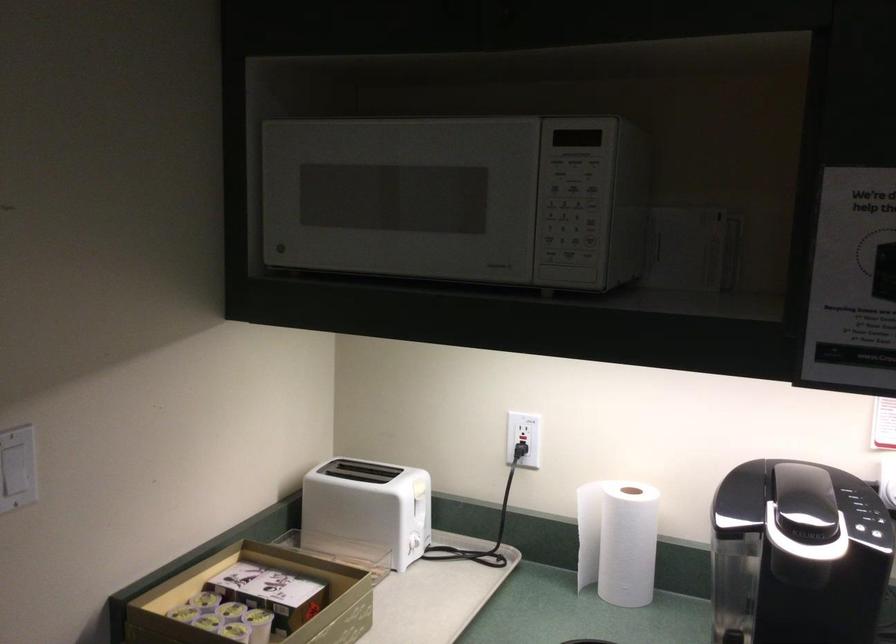
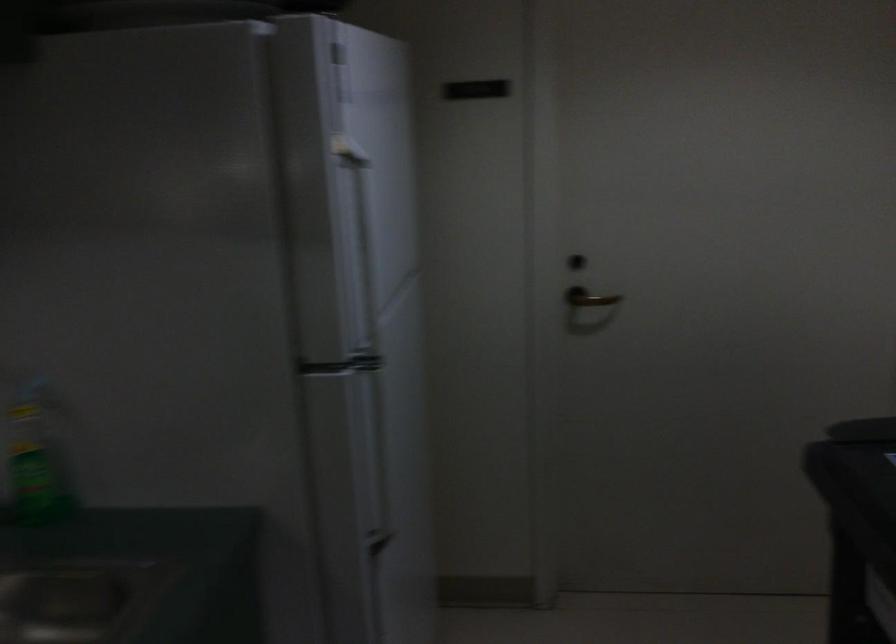
The first image is from the beginning of the video and the second image is from the end. How did the camera likely rotate when shooting the video?

The rotation direction of the camera is right-down.